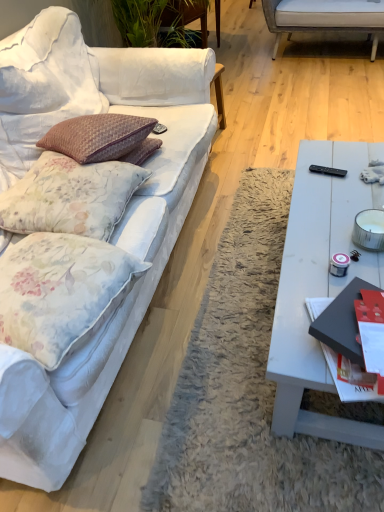
The image size is (384, 512). I want to click on free point in front of black plastic remote control at right, so click(x=335, y=196).